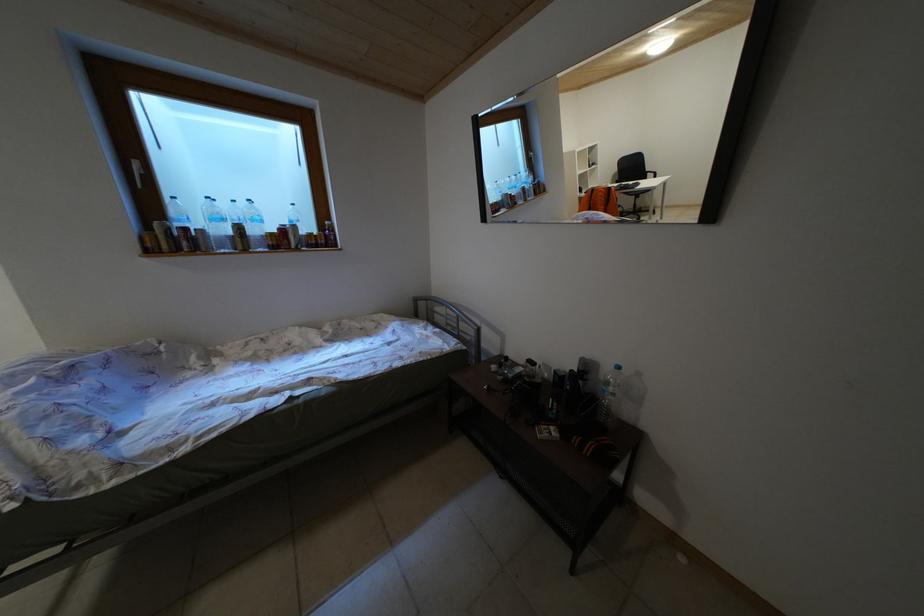
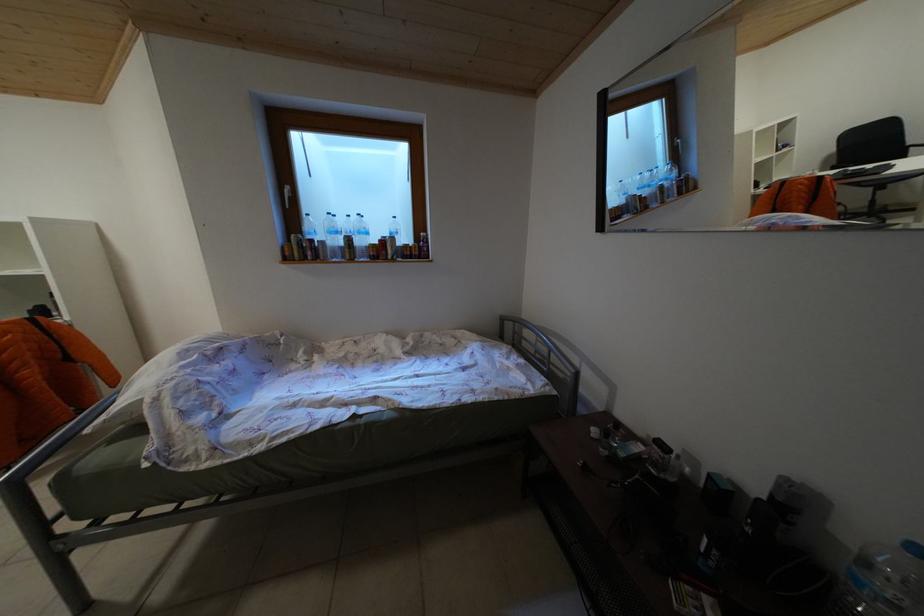
Question: The images are taken continuously from a first-person perspective. In which direction are you moving?

Choices:
 (A) Left
 (B) Right
 (C) Forward
 (D) Backward

Answer: (C)